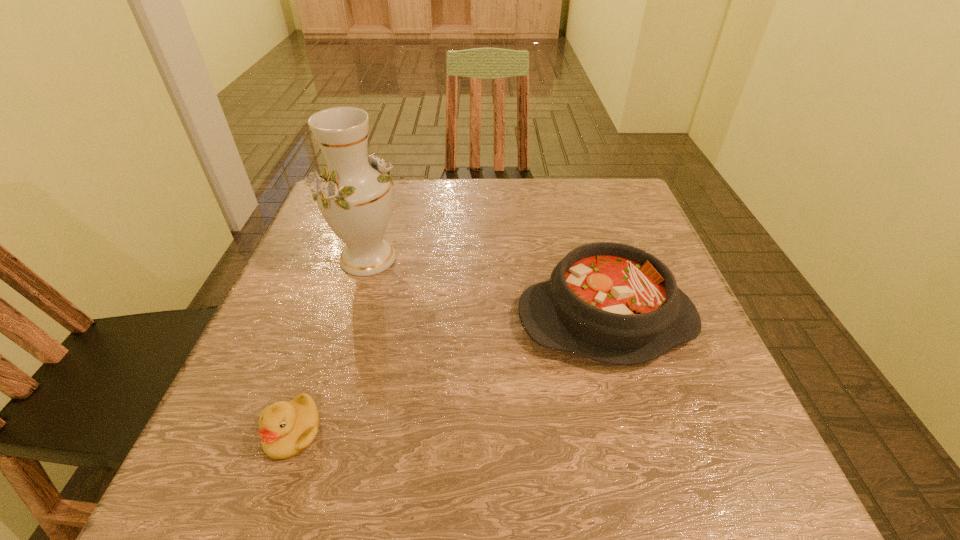
Where is `object located at the right edge`? The image size is (960, 540). object located at the right edge is located at coordinates (614, 303).

This screenshot has width=960, height=540. Find the location of `object that is at the near left corner`. object that is at the near left corner is located at coordinates tap(287, 428).

Where is `blank area at the far edge`? This screenshot has height=540, width=960. blank area at the far edge is located at coordinates (420, 225).

What are the coordinates of `vacant space at the near edge of the desktop` in the screenshot? It's located at (636, 492).

Locate an element on the screen. The height and width of the screenshot is (540, 960). vacant space at the left edge of the desktop is located at coordinates (320, 313).

Find the location of `free space at the right edge of the desktop`. free space at the right edge of the desktop is located at coordinates (730, 417).

You are a GUI agent. You are given a task and a screenshot of the screen. Output one action in this format:
    pyautogui.click(x=<x>, y=<y>)
    Task: Click on the vacant region at the far left corner of the desktop
    The image size is (960, 540).
    Given the screenshot: What is the action you would take?
    pyautogui.click(x=316, y=214)

In the image, there is a desktop. At what (x,y) coordinates should I click in order to perform the action: click on vacant space at the near left corner. Please return your answer as a coordinate pair (x, y). This screenshot has height=540, width=960. Looking at the image, I should click on (238, 462).

Identify the location of free space at the far right corner of the desktop. The height and width of the screenshot is (540, 960). [637, 208].

In the image, there is a desktop. Identify the location of blank space at the near right corner. (744, 458).